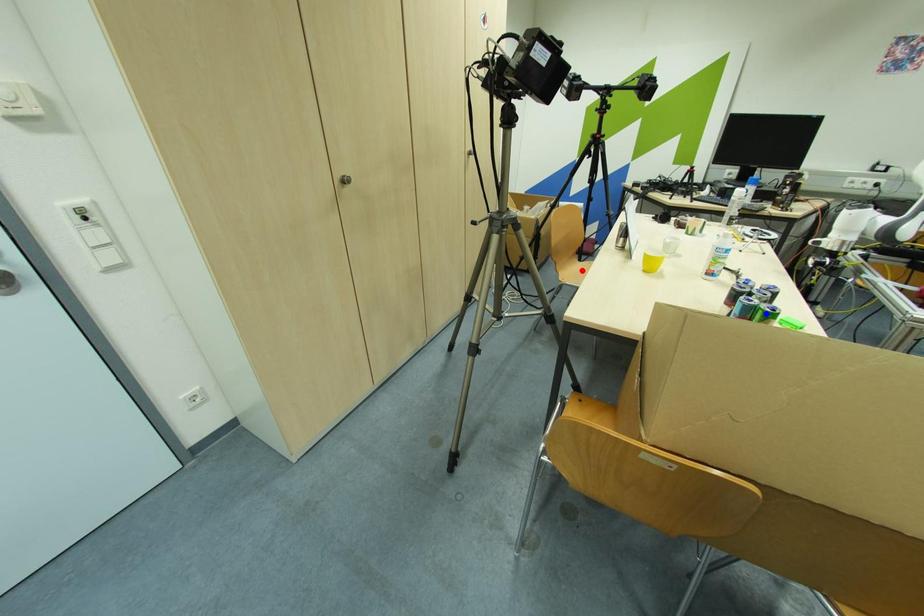
Question: Two points are marked on the image. Which point is closer to the camera?

Choices:
 (A) Blue point is closer.
 (B) Red point is closer.

Answer: (A)